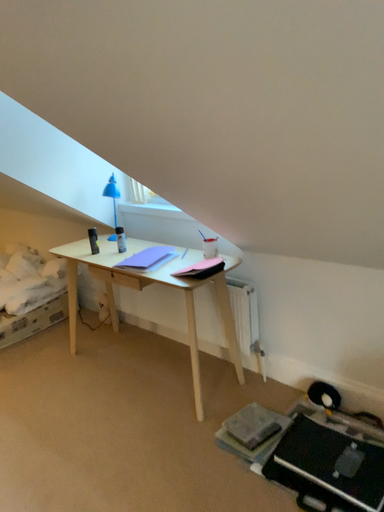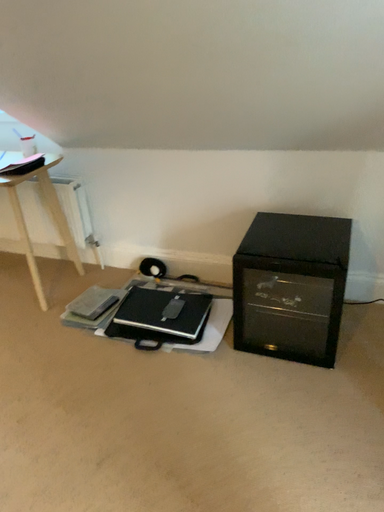
Question: How did the camera likely rotate when shooting the video?

Choices:
 (A) rotated upward
 (B) rotated downward

Answer: (B)